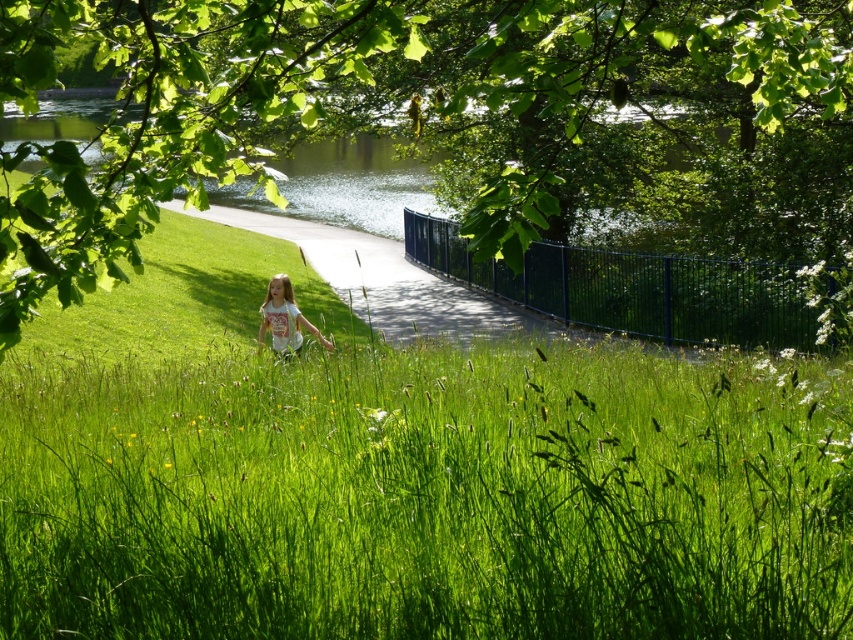
Question: Is green grassy at center to the right of green leafy tree at upper center from the viewer's perspective?

Choices:
 (A) no
 (B) yes

Answer: (B)

Question: Considering the real-world distances, which object is farthest from the white cotton shirt at center?

Choices:
 (A) green grassy at center
 (B) green leafy tree at upper center

Answer: (B)

Question: Which of the following is the closest to the observer?

Choices:
 (A) white cotton shirt at center
 (B) green leafy tree at upper center
 (C) green grassy at center

Answer: (B)

Question: Is green grassy at center wider than green leafy tree at upper center?

Choices:
 (A) no
 (B) yes

Answer: (A)

Question: Is green grassy at center in front of white cotton shirt at center?

Choices:
 (A) no
 (B) yes

Answer: (B)

Question: Which of the following is the farthest from the observer?

Choices:
 (A) white cotton shirt at center
 (B) green leafy tree at upper center
 (C) green grassy at center

Answer: (A)